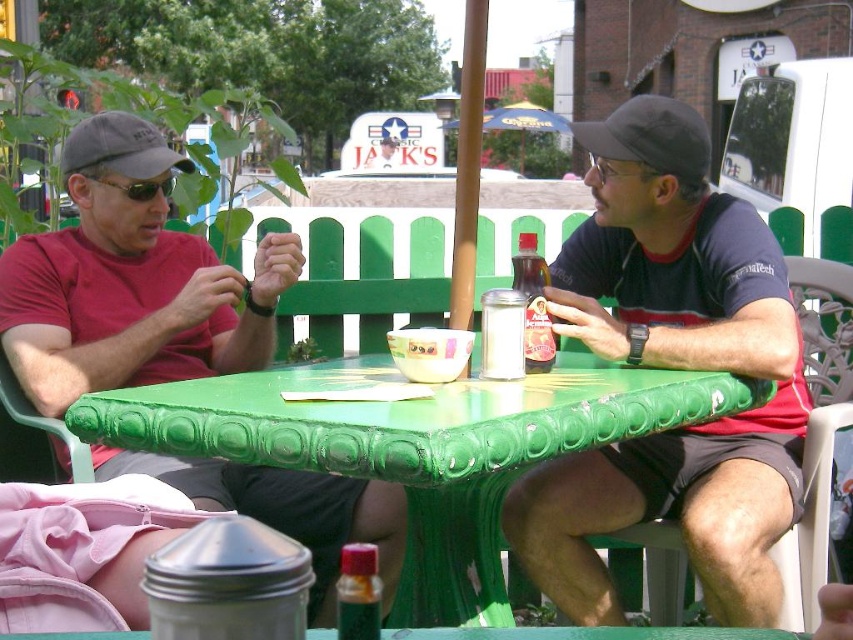
You are standing at the edge of the table and want to grab the translucent plastic bottle at center and the yellow fabric umbrella at center. Which one is farther from your current position?

The translucent plastic bottle at center is 30.30 feet away from the yellow fabric umbrella at center. Since you are at the edge of the table, the distance between the two objects is 30.30 feet, but without knowing your exact position relative to them, it is impossible to determine which is farther.

You are a photographer trying to capture a closeup of the matte black shirt at center without including the black fabric baseball cap at upper center in the frame. Is it possible to do so based on their positions?

The matte black shirt at center is below the black fabric baseball cap at upper center, so it is possible to frame the shot to exclude the cap by focusing on the lower area where the shirt is located.

What object is the point at coordinate [358,593] located on?

The point at coordinate [358,593] is located on the translucent plastic bottle at center.